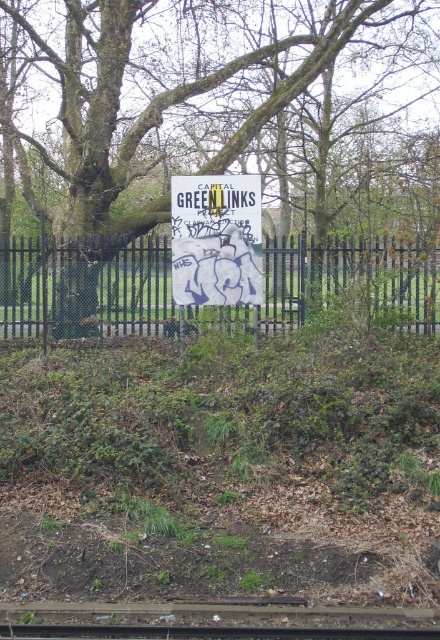
Is point (226, 305) positioned before point (25, 604)?

No.

How distant is white paper sign at center from brown wooden train track at lower center?

white paper sign at center and brown wooden train track at lower center are 17.54 feet apart.

Between point (194, 202) and point (266, 609), which one is positioned behind?

Positioned behind is point (194, 202).

Where is `white paper sign at center`? The height and width of the screenshot is (640, 440). white paper sign at center is located at coordinates (216, 240).

Between green rough bark tree at center and brown wooden train track at lower center, which one has more height?

Standing taller between the two is green rough bark tree at center.

Does green rough bark tree at center come in front of brown wooden train track at lower center?

No.

Between point (283, 8) and point (305, 608), which one is positioned in front?

Point (305, 608) is in front.

This screenshot has height=640, width=440. Identify the location of green rough bark tree at center. (216, 150).

Is green rough bark tree at center to the right of black metal train track at center from the viewer's perspective?

No, green rough bark tree at center is not to the right of black metal train track at center.

Is green rough bark tree at center to the left of black metal train track at center from the viewer's perspective?

Indeed, green rough bark tree at center is positioned on the left side of black metal train track at center.

Which is behind, point (303, 29) or point (391, 628)?

Positioned behind is point (303, 29).

The height and width of the screenshot is (640, 440). In order to click on green rough bark tree at center in this screenshot , I will do `click(216, 150)`.